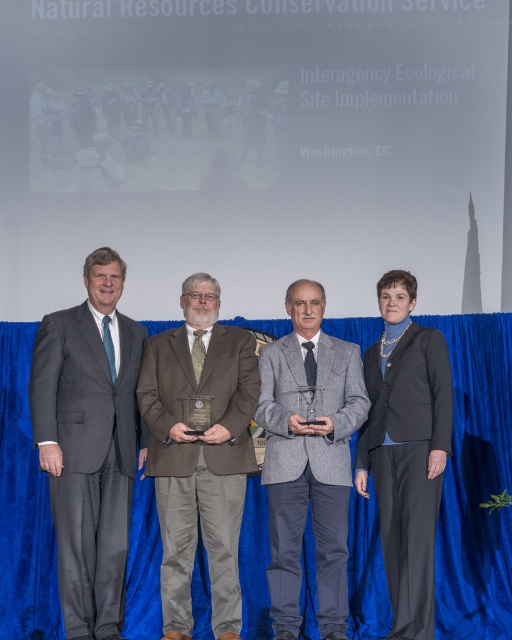
Does gray wool suit at center appear on the left side of black wool suit at right?

Correct, you'll find gray wool suit at center to the left of black wool suit at right.

Where is `gray wool suit at center`? This screenshot has height=640, width=512. gray wool suit at center is located at coordinates (309, 458).

Does matte gray suit at left come behind brown woolen suit at center?

No, it is in front of brown woolen suit at center.

Between matte gray suit at left and brown woolen suit at center, which one is positioned higher?

matte gray suit at left

Does point (114, 253) lie in front of point (239, 595)?

That is False.

The width and height of the screenshot is (512, 640). I want to click on matte gray suit at left, so click(x=90, y=444).

Who is positioned more to the left, matte gray suit at left or gray wool suit at center?

matte gray suit at left

Looking at this image, who is more distant from viewer, (74,625) or (297,544)?

Positioned behind is point (297,544).

Who is more distant from viewer, (102, 552) or (321, 460)?

The point (321, 460) is more distant.

Locate an element on the screen. The image size is (512, 640). matte gray suit at left is located at coordinates (90, 444).